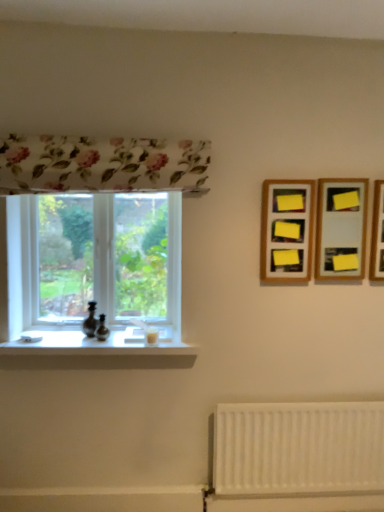
Question: Is clear glass window at left inside the boundaries of yellow paper at upper right, the second picture frame viewed from the left, or outside?

Choices:
 (A) outside
 (B) inside

Answer: (A)

Question: Considering the positions of clear glass window at left and yellow paper at upper right, which is the 2th picture frame from right to left, in the image, is clear glass window at left bigger or smaller than yellow paper at upper right, which is the 2th picture frame from right to left,?

Choices:
 (A) small
 (B) big

Answer: (B)

Question: Which object is the farthest from the white glossy window sill at lower left?

Choices:
 (A) wooden frame at upper right, acting as the third picture frame starting from the right
 (B) wooden picture frame at upper right, marked as the 1th picture frame in a right-to-left arrangement
 (C) yellow paper at upper right, the second picture frame viewed from the left
 (D) white matte radiator at lower right
 (E) clear glass window at left

Answer: (B)

Question: Which of these objects is positioned closest to the clear glass window at left?

Choices:
 (A) yellow paper at upper right, which is the 2th picture frame from right to left
 (B) white matte radiator at lower right
 (C) white glossy window sill at lower left
 (D) wooden frame at upper right, acting as the third picture frame starting from the right
 (E) wooden picture frame at upper right, marked as the 1th picture frame in a right-to-left arrangement

Answer: (C)